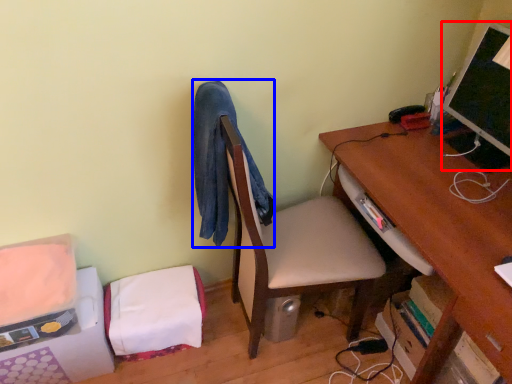
Question: Which point is closer to the camera, computer monitor (highlighted by a red box) or robe (highlighted by a blue box)?

Choices:
 (A) computer monitor
 (B) robe

Answer: (B)